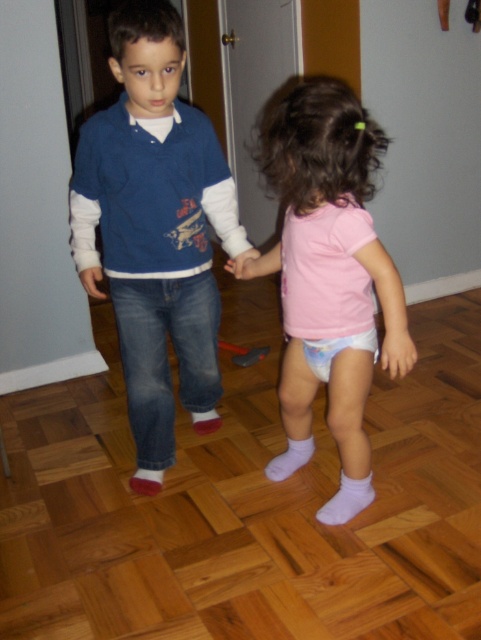
Question: In this image, where is pink fabric shorts at center located relative to pink fabric hand at center?

Choices:
 (A) below
 (B) above

Answer: (A)

Question: Is pink fabric hand at lower center above white soft sock at lower center?

Choices:
 (A) yes
 (B) no

Answer: (A)

Question: Among these points, which one is nearest to the camera?

Choices:
 (A) (100, 275)
 (B) (313, 340)
 (C) (162, 477)

Answer: (B)

Question: Which object appears farthest from the camera in this image?

Choices:
 (A) matte blue sweater at center
 (B) pink fabric hand at lower center
 (C) matte blue jeans at lower left
 (D) white fabric diaper at center

Answer: (C)

Question: Is matte blue sweater at center behind pink fabric sock at lower center?

Choices:
 (A) no
 (B) yes

Answer: (A)

Question: Which point is farther to the camera?

Choices:
 (A) (307, 362)
 (B) (204, 413)
 (C) (89, 275)
 (D) (390, 333)

Answer: (B)